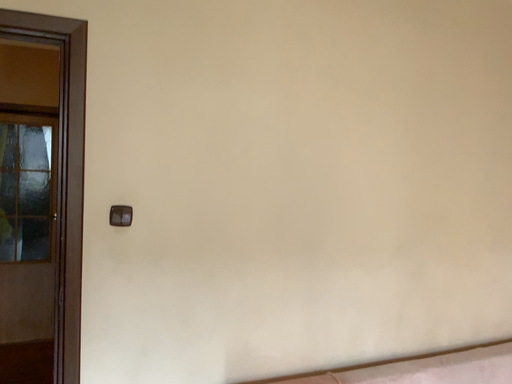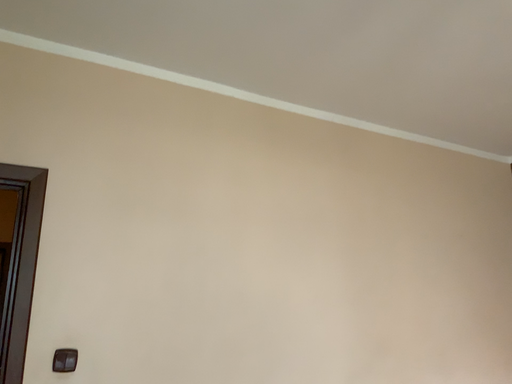
Question: Which way did the camera rotate in the video?

Choices:
 (A) rotated right
 (B) rotated left

Answer: (A)